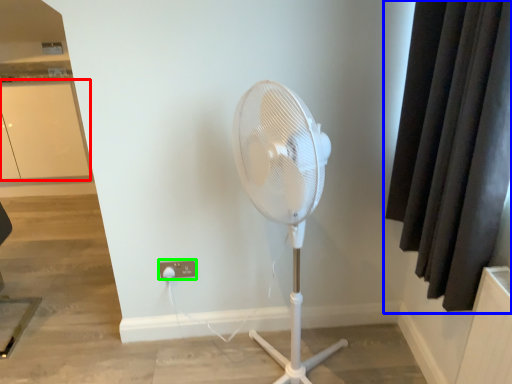
Question: Which object is positioned farthest from screen door (highlighted by a red box)? Select from curtain (highlighted by a blue box) and electric outlet (highlighted by a green box).

Choices:
 (A) curtain
 (B) electric outlet

Answer: (A)